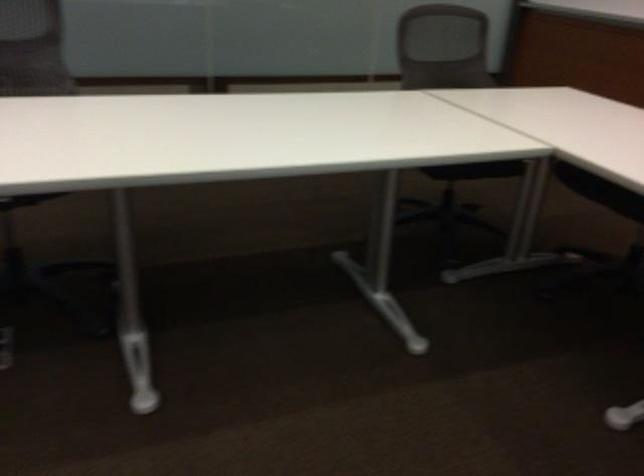
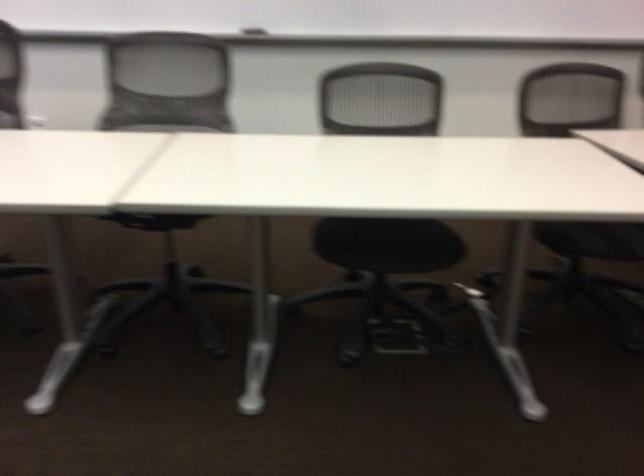
First-person continuous shooting, in which direction is the camera rotating?

The camera rotated toward left-down.